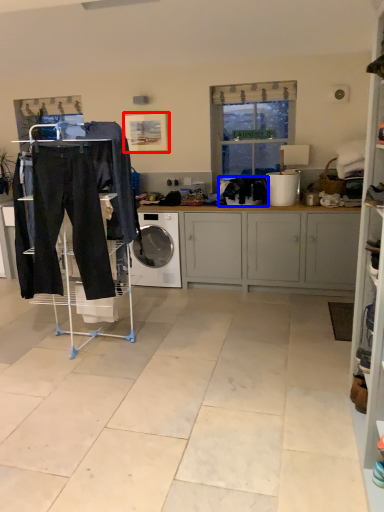
Question: Which of the following is the farthest to the observer, picture frame (highlighted by a red box) or clothing (highlighted by a blue box)?

Choices:
 (A) picture frame
 (B) clothing

Answer: (A)